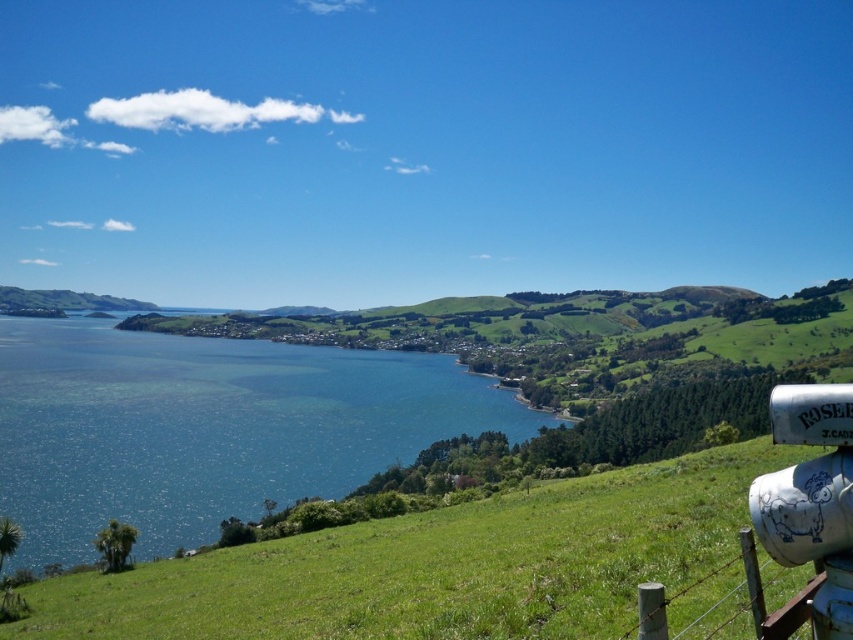
Question: Which point is closer to the camera?

Choices:
 (A) blue water at center
 (B) green grassy hillside at lower right

Answer: (B)

Question: Is green grassy hillside at lower right further to camera compared to blue water at center?

Choices:
 (A) yes
 (B) no

Answer: (B)

Question: Can you confirm if green grassy hillside at lower right is positioned below blue water at center?

Choices:
 (A) no
 (B) yes

Answer: (A)

Question: Which object is closer to the camera taking this photo?

Choices:
 (A) blue water at center
 (B) green grassy hillside at lower right

Answer: (B)

Question: Does green grassy hillside at lower right lie in front of blue water at center?

Choices:
 (A) yes
 (B) no

Answer: (A)